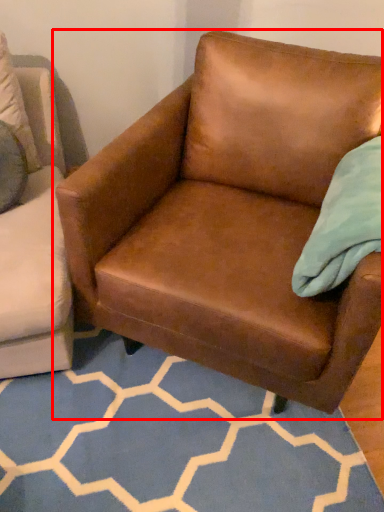
Question: From the image's perspective, considering the relative positions of chair (annotated by the red box) and pattern in the image provided, where is chair (annotated by the red box) located with respect to the staircase?

Choices:
 (A) below
 (B) above

Answer: (B)